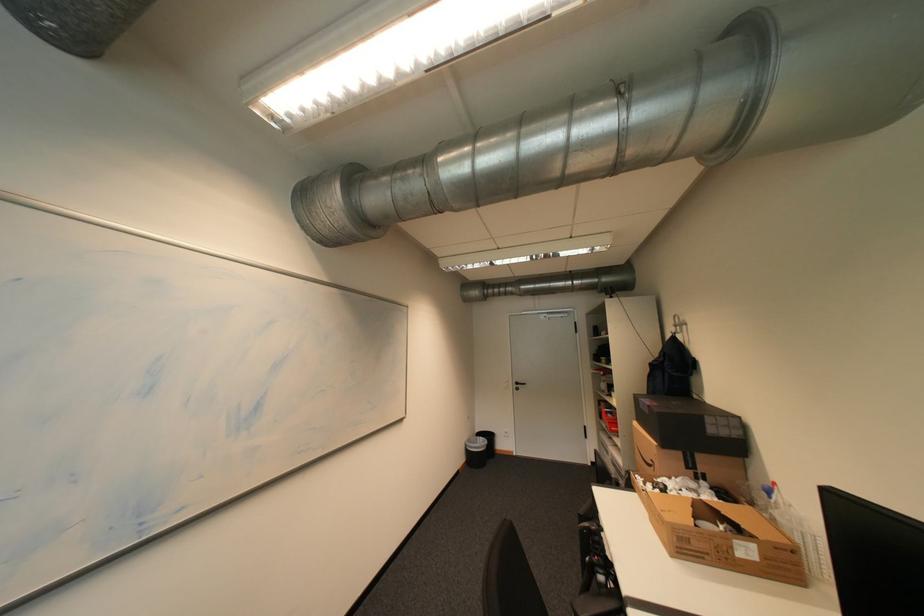
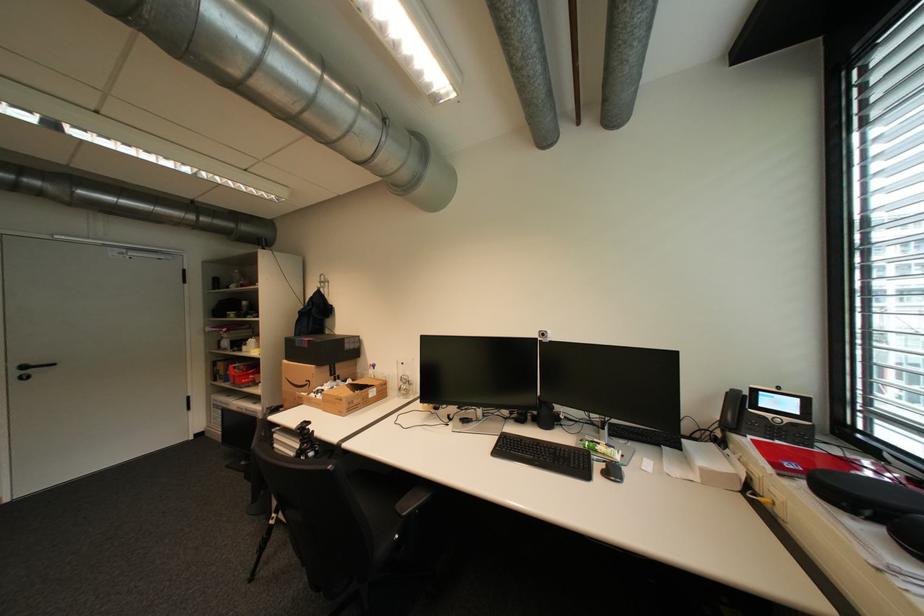
The point at (x=659, y=365) is marked in the first image. Where is the corresponding point in the second image?

(308, 312)